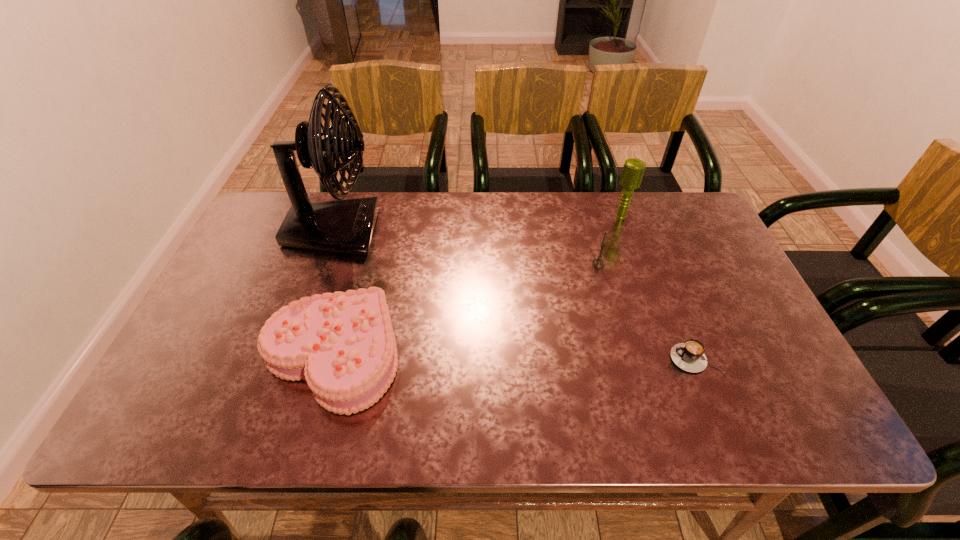
Identify the location of the tallest object. pos(346,226).

In order to click on the fourth shortest object in this screenshot , I will do `click(633, 170)`.

This screenshot has width=960, height=540. What are the coordinates of `candle` in the screenshot? It's located at (598, 263).

At what (x,y) coordinates should I click in order to perform the action: click on the third object from right to left. Please return your answer as a coordinate pair (x, y). Looking at the image, I should click on (598, 263).

You are a GUI agent. You are given a task and a screenshot of the screen. Output one action in this format:
    pyautogui.click(x=<x>, y=<y>)
    Task: Click on the fourth tallest object
    The width and height of the screenshot is (960, 540).
    Given the screenshot: What is the action you would take?
    pyautogui.click(x=343, y=344)

Identify the location of the shortest object. (689, 356).

Locate an element on the screen. The width and height of the screenshot is (960, 540). free location located in front of the fan to blow air is located at coordinates (430, 231).

The width and height of the screenshot is (960, 540). In order to click on vacant space located 0.050m on the right of the fourth shortest object in this screenshot , I will do `click(646, 217)`.

I want to click on free location located 0.140m on the back of the candle, so click(x=588, y=228).

The image size is (960, 540). Identify the location of free spot located on the right of the second shortest object. (493, 355).